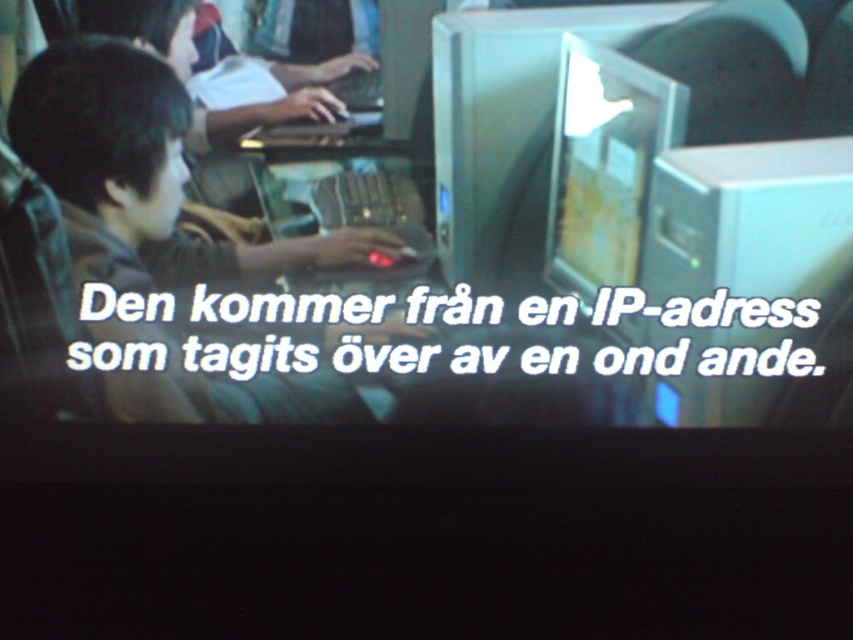
Who is lower down, matte black laptop at left or white plastic computer at right?

white plastic computer at right is lower down.

Can you confirm if matte black laptop at left is taller than white plastic computer at right?

Indeed, matte black laptop at left has a greater height compared to white plastic computer at right.

From the picture: Who is more forward, [108,234] or [846,196]?

Point [846,196]

The height and width of the screenshot is (640, 853). I want to click on matte black laptop at left, so click(x=138, y=173).

Can you confirm if matte black laptop at left is positioned to the left of metallic silver computer monitor at center?

Indeed, matte black laptop at left is positioned on the left side of metallic silver computer monitor at center.

Is matte black laptop at left positioned behind metallic silver computer monitor at center?

Yes, matte black laptop at left is further from the viewer.

In order to click on matte black laptop at left in this screenshot , I will do [138, 173].

Is metallic silver computer monitor at center above matte black monitor at center?

Indeed, metallic silver computer monitor at center is positioned over matte black monitor at center.

Is point (616, 19) more distant than point (599, 257)?

No, (616, 19) is closer to viewer.

What do you see at coordinates (508, 129) in the screenshot?
I see `metallic silver computer monitor at center` at bounding box center [508, 129].

Image resolution: width=853 pixels, height=640 pixels. In order to click on metallic silver computer monitor at center in this screenshot , I will do `click(508, 129)`.